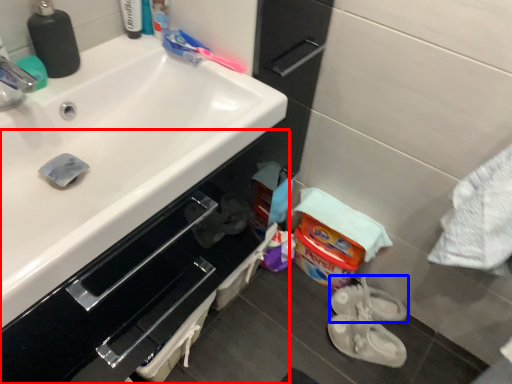
Question: Which of the following is the farthest to the observer, bathroom cabinet (highlighted by a red box) or footwear (highlighted by a blue box)?

Choices:
 (A) bathroom cabinet
 (B) footwear

Answer: (B)